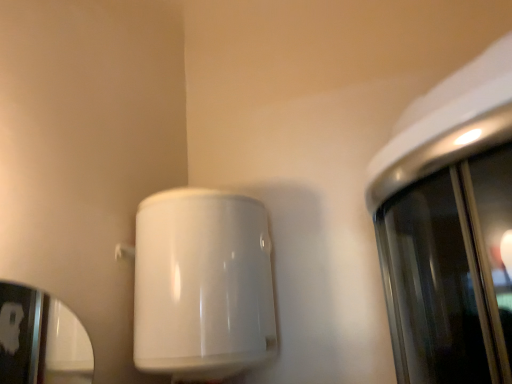
In order to click on white glossy toilet paper holder at center in this screenshot , I will do `click(202, 285)`.

This screenshot has height=384, width=512. Describe the element at coordinates (202, 285) in the screenshot. I see `white glossy toilet paper holder at center` at that location.

Find the location of a particular element. This screenshot has height=384, width=512. white glossy toilet paper holder at center is located at coordinates (202, 285).